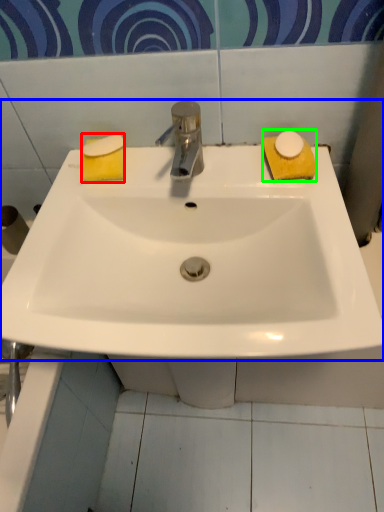
Question: Which object is positioned closest to soap (highlighted by a red box)? Select from sink (highlighted by a blue box) and soap (highlighted by a green box).

Choices:
 (A) sink
 (B) soap

Answer: (A)